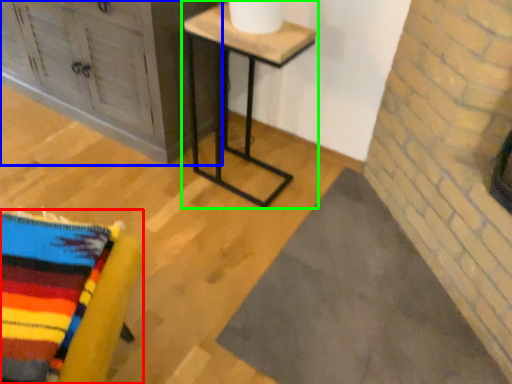
Question: Based on their relative distances, which object is nearer to furniture (highlighted by a red box)? Choose from furniture (highlighted by a blue box) and table (highlighted by a green box).

Choices:
 (A) furniture
 (B) table

Answer: (B)